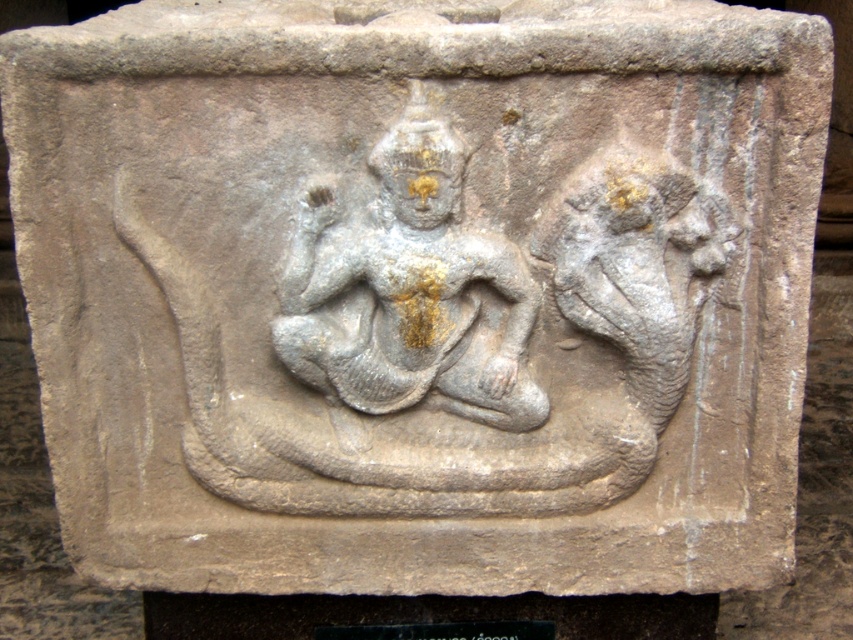
You are an archaeologist examining the stone relief sculpture. You notice two points on the sculpture labeled as point 1 at coordinates point (453, 316) and point 2 at coordinates point (424, 296). Which point is closer to you as you stand in front of the sculpture?

Point (453, 316) is further to the viewer than point (424, 296), so point (424, 296) is closer to you.

You are an archaeologist examining the stone relief sculpture. You notice two objects labeled gray stone carving at center and gray stone deity at center. Which one is positioned to the right of the other?

The gray stone carving at center is positioned to the right of the gray stone deity at center.